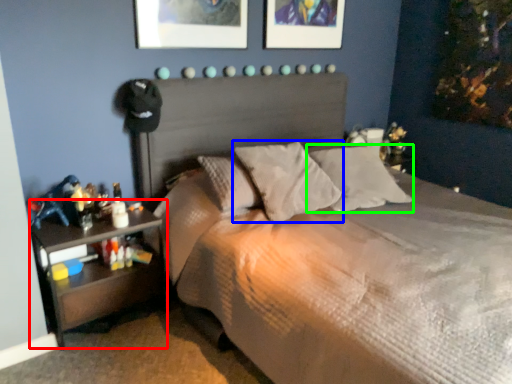
Question: Based on their relative distances, which object is nearer to nightstand (highlighted by a red box)? Choose from pillow (highlighted by a blue box) and pillow (highlighted by a green box).

Choices:
 (A) pillow
 (B) pillow

Answer: (A)